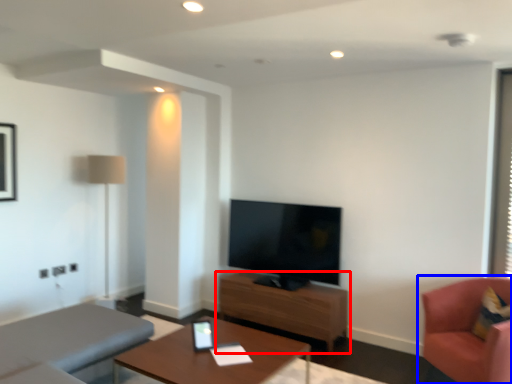
Question: Among these objects, which one is nearest to the camera, table (highlighted by a red box) or chair (highlighted by a blue box)?

Choices:
 (A) table
 (B) chair

Answer: (B)